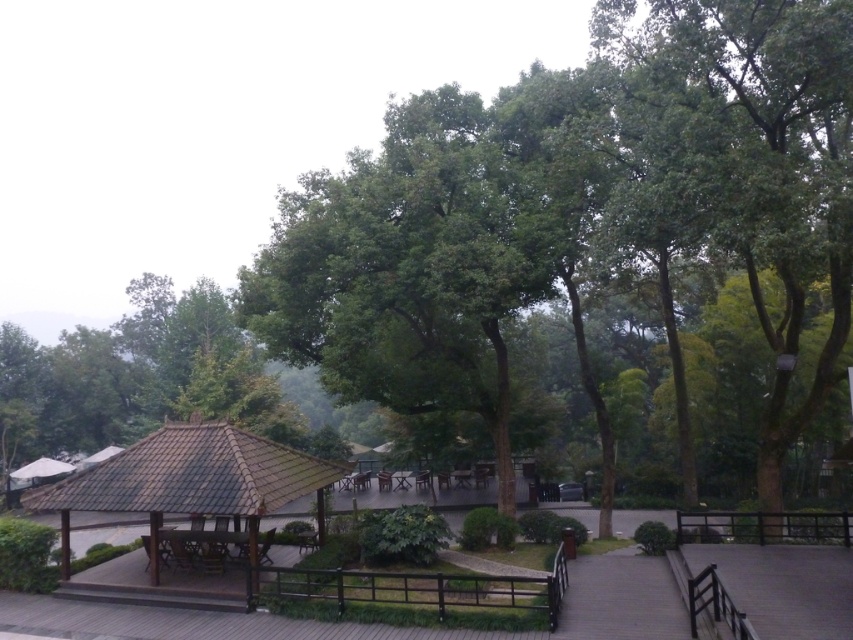
Between brown wooden gazebo at center and white fabric canopy at upper left, which one is positioned higher?

brown wooden gazebo at center

Is point (227, 429) farther from viewer compared to point (13, 477)?

No, it is not.

Does point (181, 472) come behind point (71, 465)?

That is False.

Identify the location of brown wooden gazebo at center. The width and height of the screenshot is (853, 640). (189, 481).

You are a GUI agent. You are given a task and a screenshot of the screen. Output one action in this format:
    pyautogui.click(x=<x>, y=<y>)
    Task: Click on the wooden picnic table at center
    
    Given the screenshot: What is the action you would take?
    pyautogui.click(x=196, y=548)

Consider the image. Is wooden picnic table at center closer to the viewer compared to white fabric canopy at upper left?

Yes, it is in front of white fabric canopy at upper left.

Is point (202, 547) in front of point (33, 476)?

Yes, it is.

Image resolution: width=853 pixels, height=640 pixels. Identify the location of wooden picnic table at center. (196, 548).

Is brown wooden gazebo at center positioned behind wooden picnic table at center?

No, it is not.

Is brown wooden gazebo at center shorter than wooden picnic table at center?

Incorrect, brown wooden gazebo at center's height does not fall short of wooden picnic table at center's.

You are a GUI agent. You are given a task and a screenshot of the screen. Output one action in this format:
    pyautogui.click(x=<x>, y=<y>)
    Task: Click on the brown wooden gazebo at center
    Image resolution: width=853 pixels, height=640 pixels.
    Given the screenshot: What is the action you would take?
    pyautogui.click(x=189, y=481)